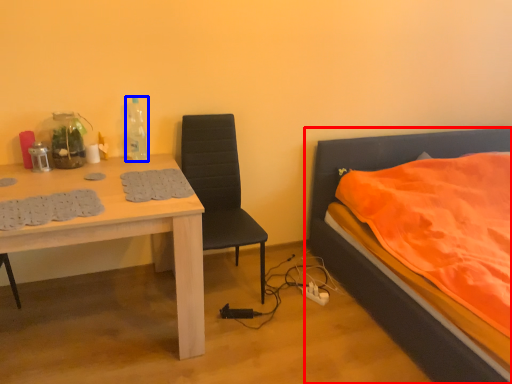
Question: Among these objects, which one is farthest to the camera, bed (highlighted by a red box) or bottle (highlighted by a blue box)?

Choices:
 (A) bed
 (B) bottle

Answer: (B)